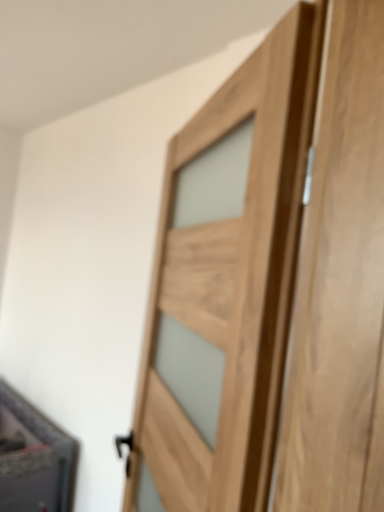
Question: In the image, is natural wood door at center on the left side or the right side of matte black cabinet at lower left?

Choices:
 (A) left
 (B) right

Answer: (B)

Question: Considering their positions, is natural wood door at center located in front of or behind matte black cabinet at lower left?

Choices:
 (A) front
 (B) behind

Answer: (A)

Question: From a real-world perspective, is natural wood door at center positioned above or below matte black cabinet at lower left?

Choices:
 (A) below
 (B) above

Answer: (B)

Question: Do you think matte black cabinet at lower left is within natural wood door at center, or outside of it?

Choices:
 (A) inside
 (B) outside

Answer: (B)

Question: In terms of height, does matte black cabinet at lower left look taller or shorter compared to natural wood door at center?

Choices:
 (A) tall
 (B) short

Answer: (B)

Question: From the image's perspective, is matte black cabinet at lower left above or below natural wood door at center?

Choices:
 (A) above
 (B) below

Answer: (B)

Question: Is point (0, 379) positioned closer to the camera than point (233, 408)?

Choices:
 (A) farther
 (B) closer

Answer: (A)